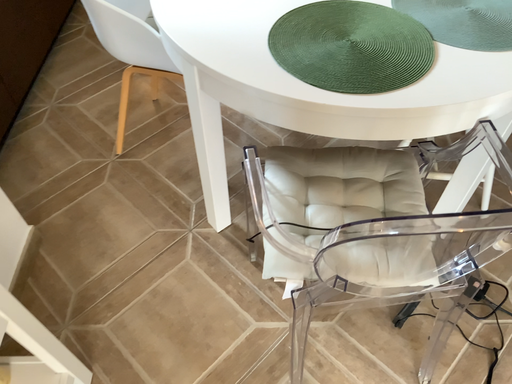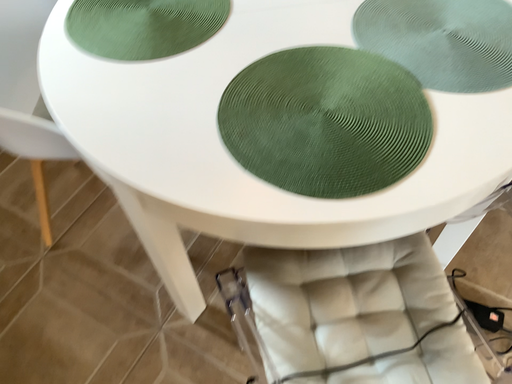
Question: Which way did the camera rotate in the video?

Choices:
 (A) rotated left
 (B) rotated right

Answer: (B)